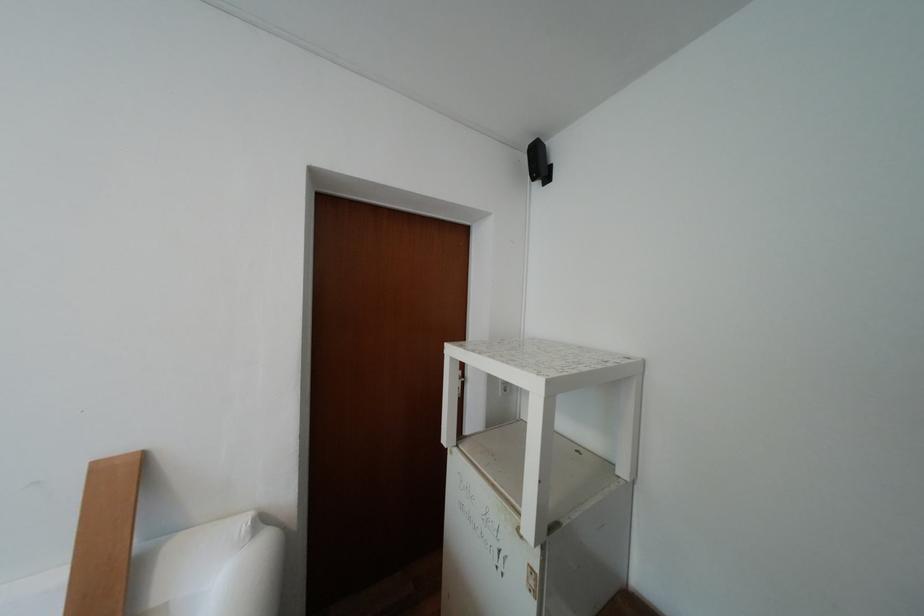
You are a GUI agent. You are given a task and a screenshot of the screen. Output one action in this format:
    pyautogui.click(x=<x>, y=<y>)
    Task: Click on the white sofa armrest
    
    Given the screenshot: What is the action you would take?
    pyautogui.click(x=251, y=577)